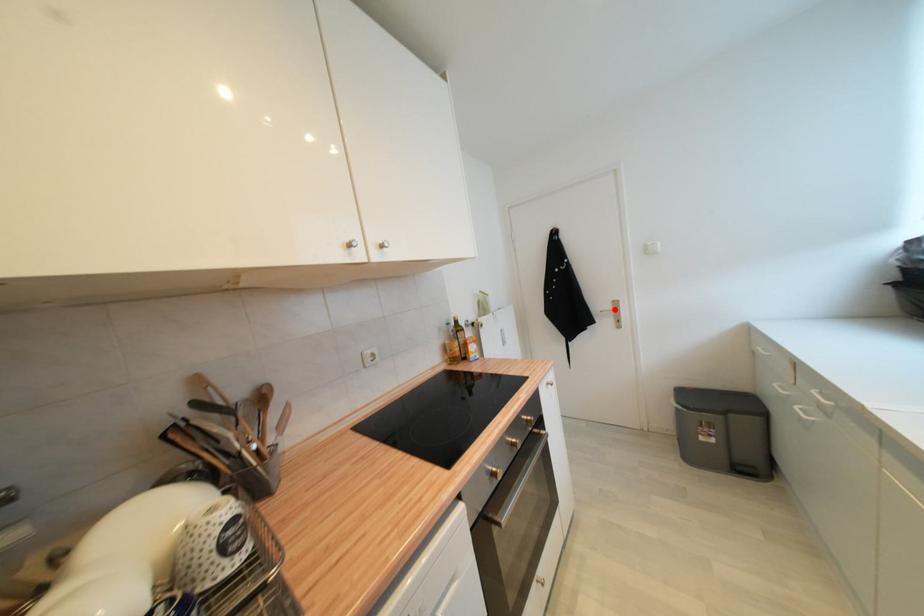
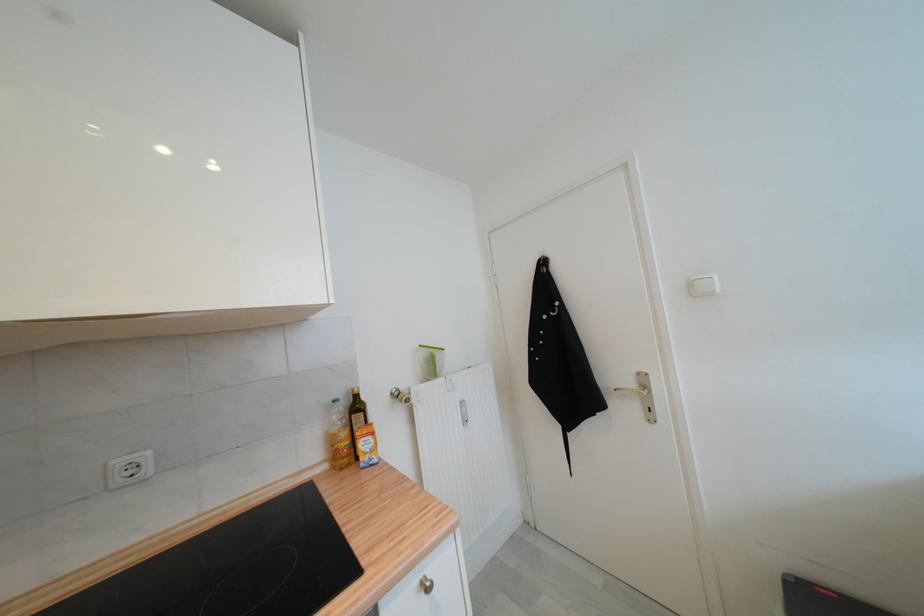
Question: I am providing you with two images of the same scene from different viewpoints. Given a red point in image1, look at the same physical point in image2. Is it:

Choices:
 (A) Closer to the viewpoint
 (B) Farther from the viewpoint

Answer: (B)